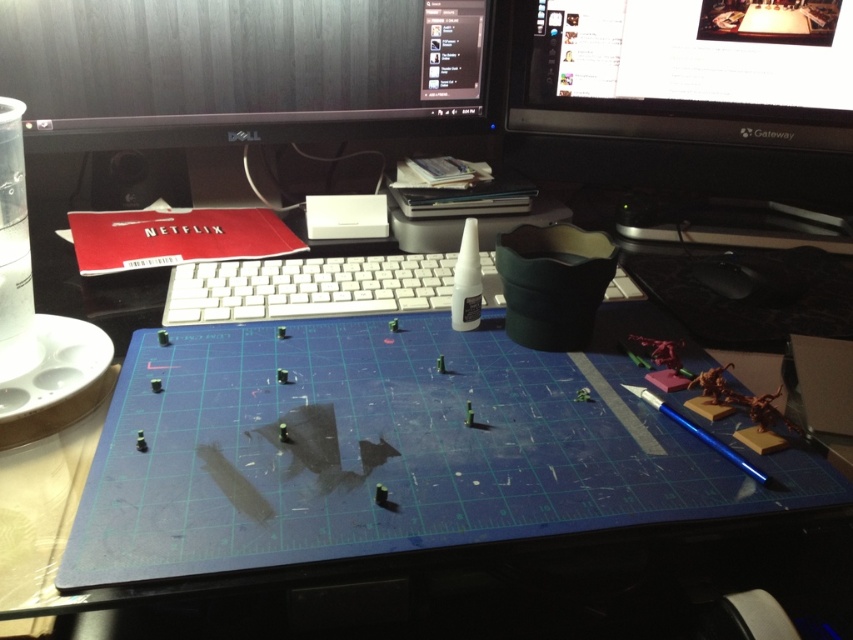
Question: In this image, where is black glossy gateway monitor at upper right located relative to white plastic keyboard at center?

Choices:
 (A) left
 (B) right

Answer: (B)

Question: Can you confirm if black plastic monitor at upper center is smaller than black glossy gateway monitor at upper right?

Choices:
 (A) no
 (B) yes

Answer: (B)

Question: Which object is positioned closest to the black glossy gateway monitor at upper right?

Choices:
 (A) black plastic monitor at upper center
 (B) blue cutting mat at center
 (C) white plastic keyboard at center

Answer: (A)

Question: Which of the following is the farthest from the observer?

Choices:
 (A) 654,16
 (B) 399,285

Answer: (A)

Question: In this image, where is blue cutting mat at center located relative to white plastic keyboard at center?

Choices:
 (A) left
 (B) right

Answer: (B)

Question: Which of the following is the closest to the observer?

Choices:
 (A) (778, 356)
 (B) (125, 102)
 (C) (550, 108)

Answer: (A)